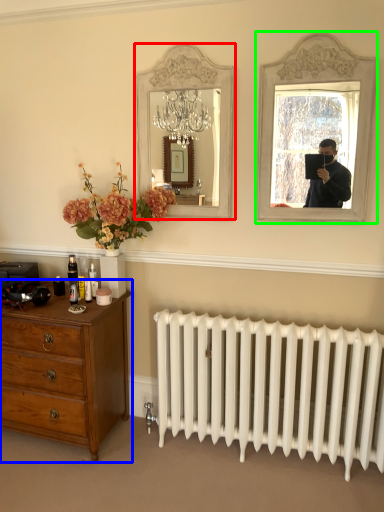
Question: Which object is the farthest from mirror (highlighted by a red box)? Choose among these: chest of drawers (highlighted by a blue box) or picture frame (highlighted by a green box).

Choices:
 (A) chest of drawers
 (B) picture frame

Answer: (A)